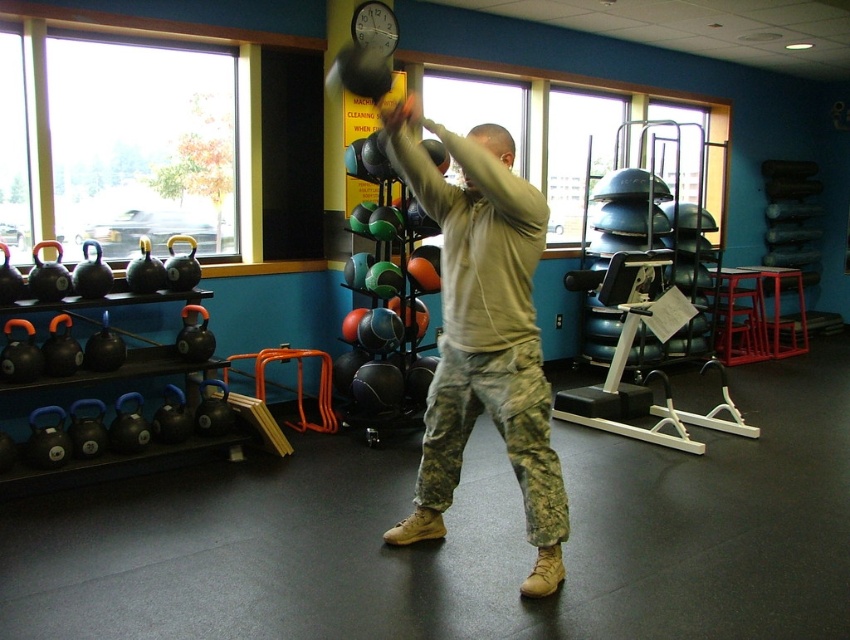
Is camouflage pants at center below light brown hair at center?

Indeed, camouflage pants at center is positioned under light brown hair at center.

Can you confirm if camouflage pants at center is wider than light brown hair at center?

Yes.

Is point (523, 374) positioned behind point (483, 132)?

Yes, point (523, 374) is farther from viewer.

Locate an element on the screen. camouflage pants at center is located at coordinates (483, 339).